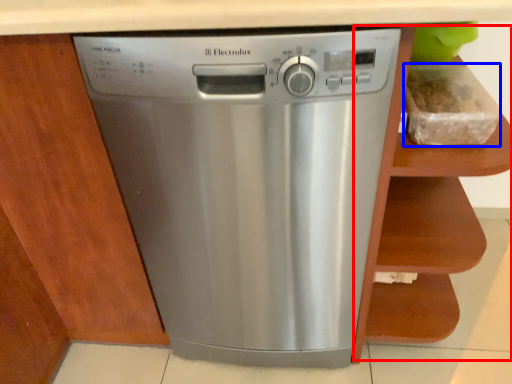
Question: Which object appears farthest to the camera in this image, cabinet (highlighted by a red box) or food (highlighted by a blue box)?

Choices:
 (A) cabinet
 (B) food

Answer: (B)